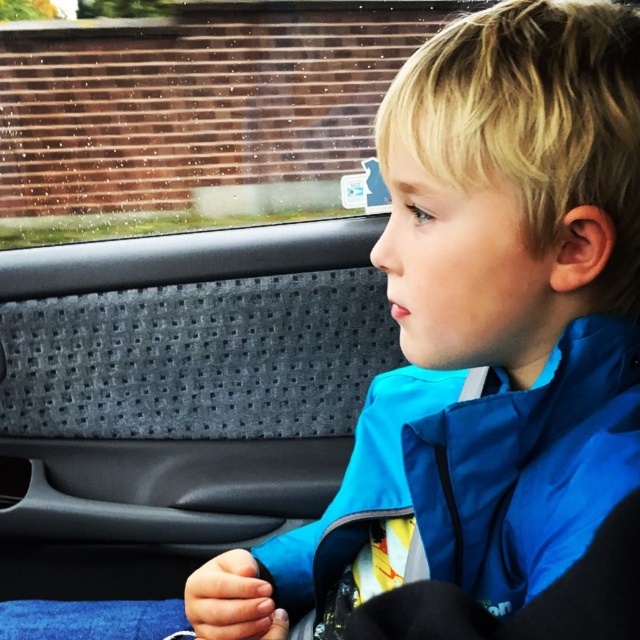
From the picture: Is transparent glass window at upper left behind blue fabric jacket at center?

That is True.

Does point (90, 65) lie behind point (593, 529)?

Yes, point (90, 65) is farther from viewer.

At what (x,y) coordinates should I click in order to perform the action: click on transparent glass window at upper left. Please return your answer as a coordinate pair (x, y). Looking at the image, I should click on (198, 116).